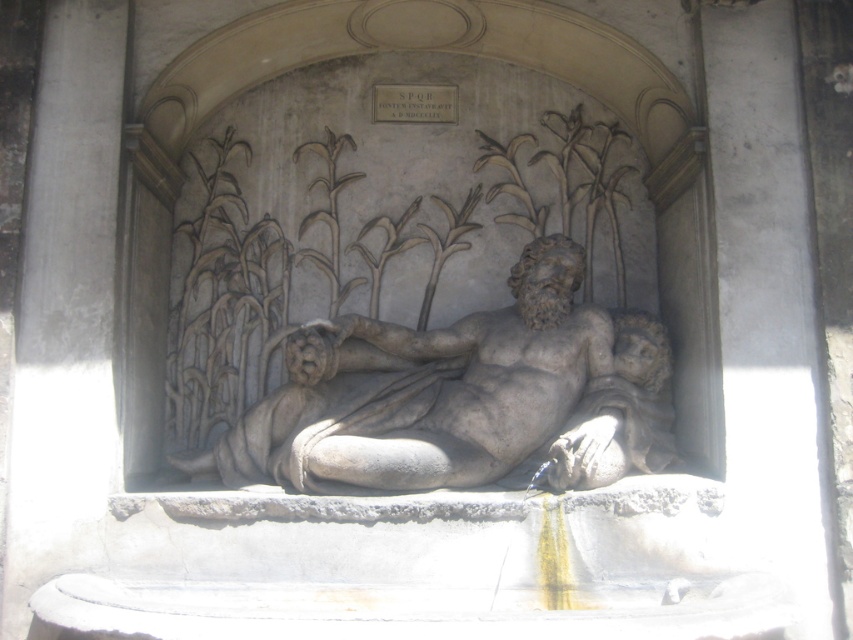
Is point (529, 273) behind point (631, 392)?

That is True.

Which is in front, point (486, 376) or point (590, 381)?

Point (486, 376) is more forward.

Where is `gray stone reclining man at center`? gray stone reclining man at center is located at coordinates (424, 392).